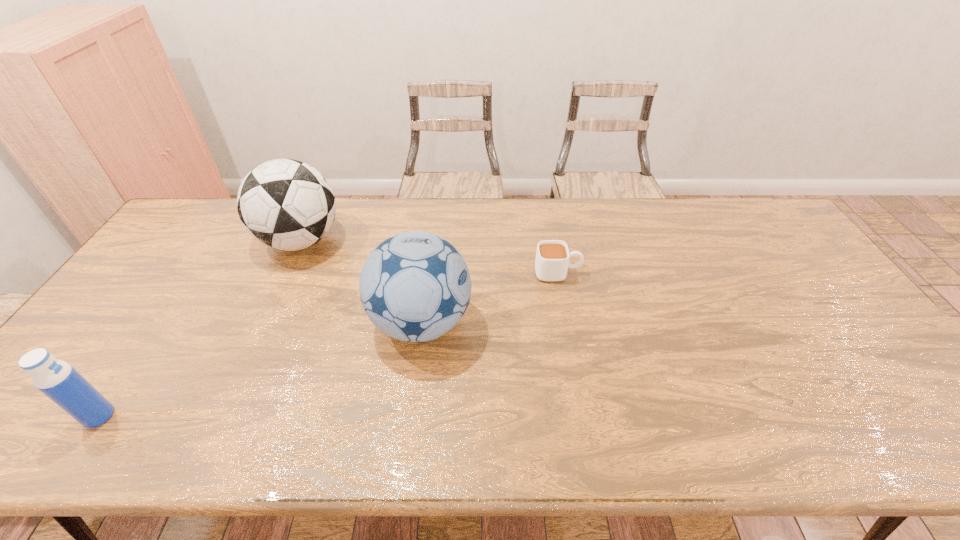
Image resolution: width=960 pixels, height=540 pixels. Find the location of `the left soccer ball`. the left soccer ball is located at coordinates (285, 204).

What are the coordinates of `the second object from left to right` in the screenshot? It's located at (285, 204).

Identify the location of the second object from right to left. Image resolution: width=960 pixels, height=540 pixels. (415, 286).

What are the coordinates of `the nearer soccer ball` in the screenshot? It's located at (415, 286).

Image resolution: width=960 pixels, height=540 pixels. I want to click on the nearest object, so click(x=58, y=380).

Identify the location of the leftmost object. This screenshot has width=960, height=540. (58, 380).

Find the location of a particular element. Image resolution: width=960 pixels, height=540 pixels. the rightmost object is located at coordinates (552, 256).

Where is `the shortest object`? the shortest object is located at coordinates [x=552, y=256].

This screenshot has height=540, width=960. In order to click on free spot located on the surface of the farther soccer ball where the brand logo is visible in this screenshot , I will do `click(365, 241)`.

This screenshot has width=960, height=540. Find the location of `vacant space located on the side with brand of the nearer soccer ball`. vacant space located on the side with brand of the nearer soccer ball is located at coordinates (609, 323).